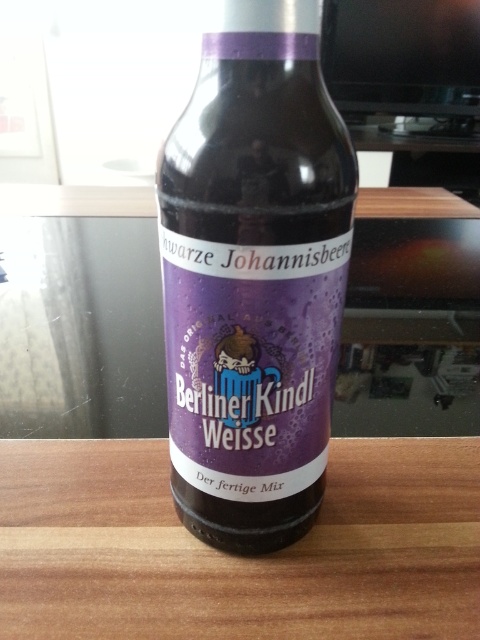
You are holding a smartphone and want to take a photo of the matte glass bottle at center and the wooden table at center. Which object should you focus on first to ensure both are in sharp focus?

You should focus on the matte glass bottle at center first because it is closer to the viewer than the wooden table at center, so focusing on it will help ensure both are in sharp focus.